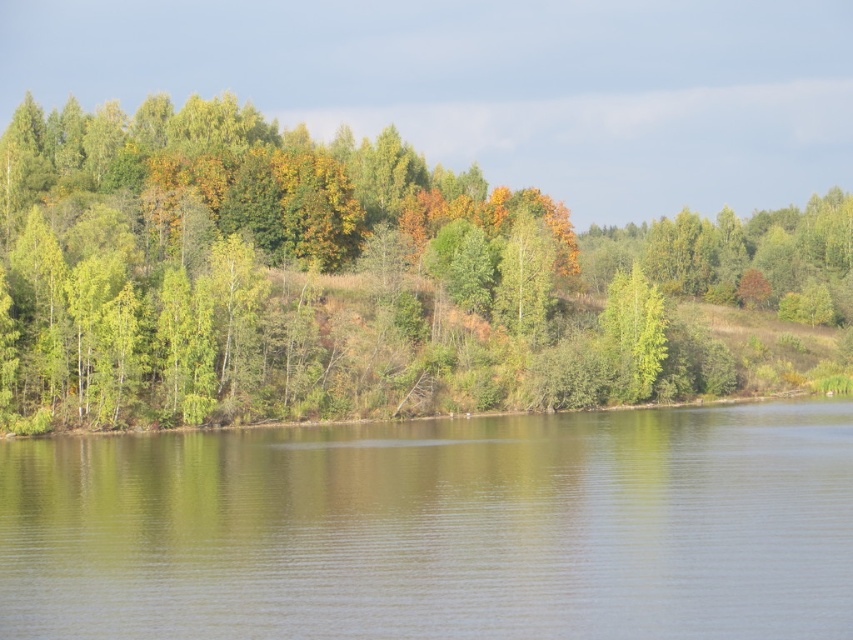
The width and height of the screenshot is (853, 640). Describe the element at coordinates (349, 278) in the screenshot. I see `green leafy trees at center` at that location.

Locate an element on the screen. green leafy trees at center is located at coordinates (349, 278).

Who is positioned more to the right, green reflective water at center or green matte tree at center?

Positioned to the right is green matte tree at center.

Who is positioned more to the left, green reflective water at center or green matte tree at center?

Positioned to the left is green reflective water at center.

Between point (843, 444) and point (611, 300), which one is positioned behind?

The point (611, 300) is behind.

I want to click on green reflective water at center, so click(x=439, y=528).

From the picture: Is green leafy trees at center behind green reflective water at center?

Yes, green leafy trees at center is further from the viewer.

Which is behind, point (778, 365) or point (347, 429)?

The point (778, 365) is more distant.

Identify the location of green leafy trees at center. The width and height of the screenshot is (853, 640). (349, 278).